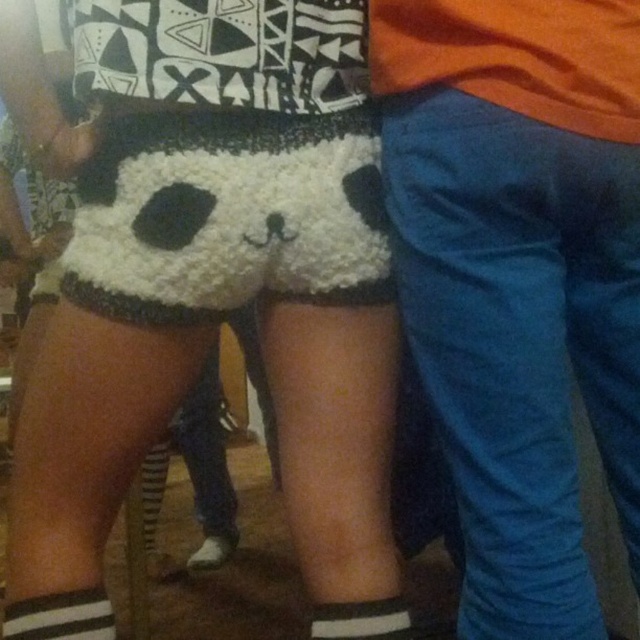
You are a fashion designer observing the image. You need to decide which item is more suitable for a winter collection between the white fluffy shorts at center and the white knit sock at lower center. Based on their sizes, which one is bigger?

The white fluffy shorts at center is larger in size than the white knit sock at lower center, so the white fluffy shorts at center would be more suitable for a winter collection as it covers more body area.

In the scene shown: What is the exact coordinate of the white fluffy shorts at center?

The white fluffy shorts at center is located at point (x=518, y=340).

You are a photographer trying to capture a clear shot of both the white fluffy shorts at center and the white fuzzy shorts at center. Since they are partially overlapping, which one should you focus on to ensure the background person doesn

The white fluffy shorts at center is larger in size than the white fuzzy shorts at center, so focusing on the white fluffy shorts at center would ensure that the background person is less obscured and clearer in the photo.